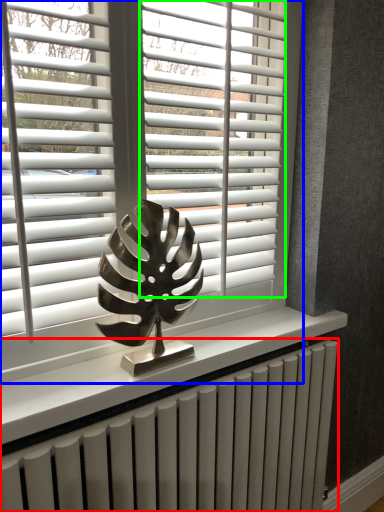
Question: Which is farther away from radiator (highlighted by a red box)? window blind (highlighted by a blue box) or blind (highlighted by a green box)?

Choices:
 (A) window blind
 (B) blind

Answer: (B)